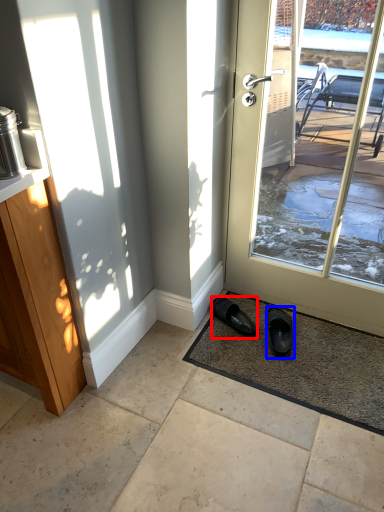
Question: Which object appears closest to the camera in this image, footwear (highlighted by a red box) or footwear (highlighted by a blue box)?

Choices:
 (A) footwear
 (B) footwear

Answer: (B)